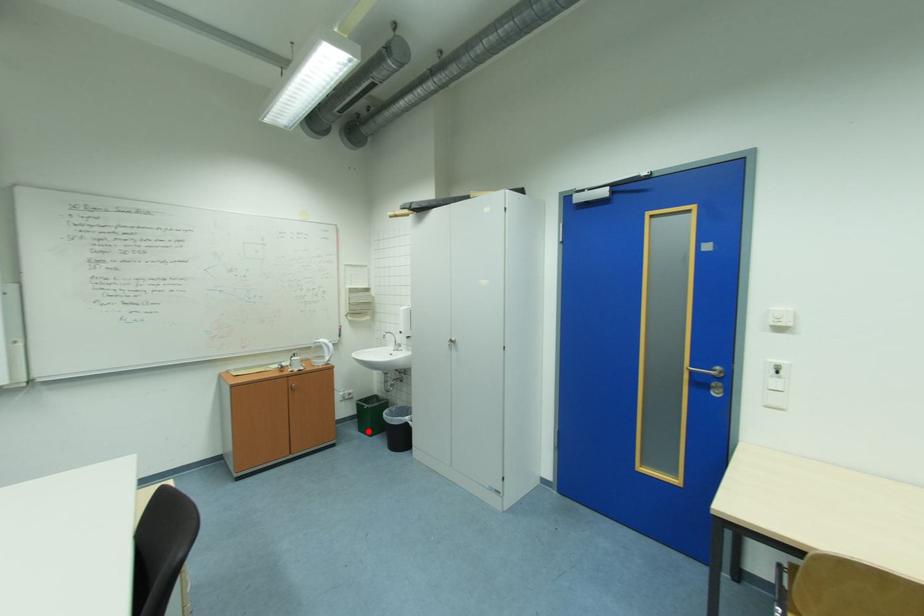
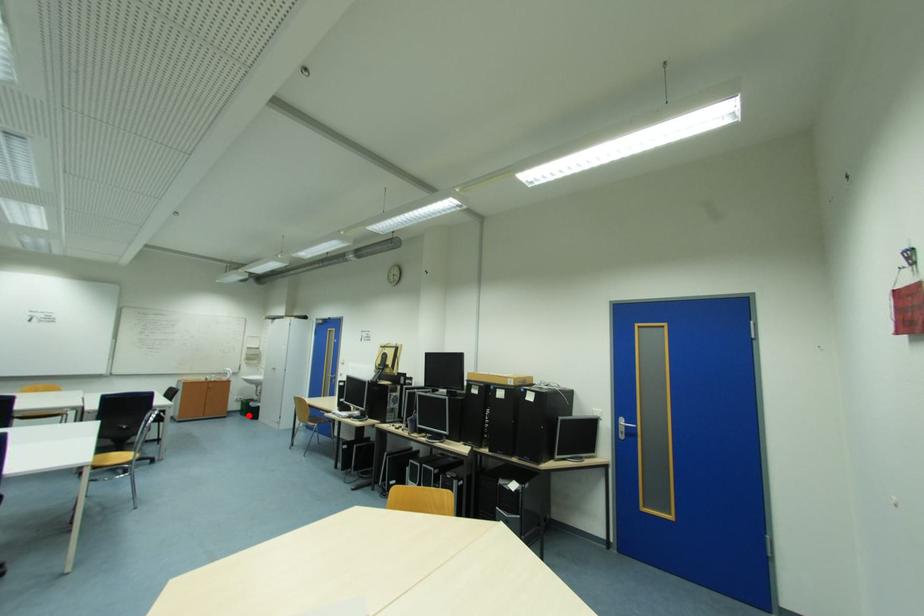
I am providing you with two images of the same scene from different viewpoints. A red point is marked on the first image and another point is marked on the second image. Is the red point in image1 aligned with the point shown in image2?

Yes